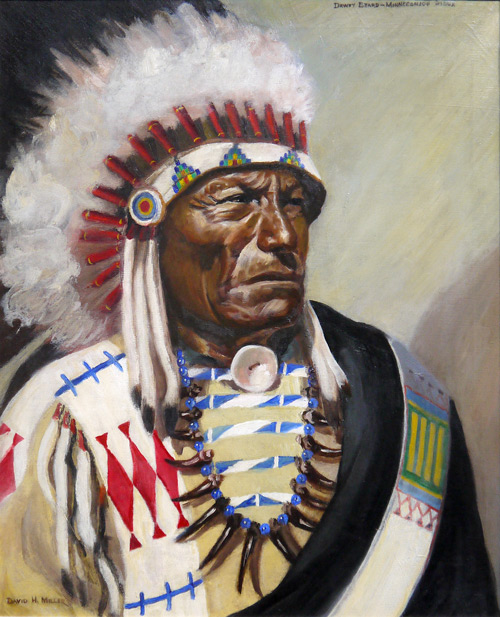
You are a GUI agent. You are given a task and a screenshot of the screen. Output one action in this format:
    pyautogui.click(x=<x>, y=<y>)
    Task: Click on the painting
    The height and width of the screenshot is (617, 500).
    Given the screenshot: What is the action you would take?
    pyautogui.click(x=327, y=503)